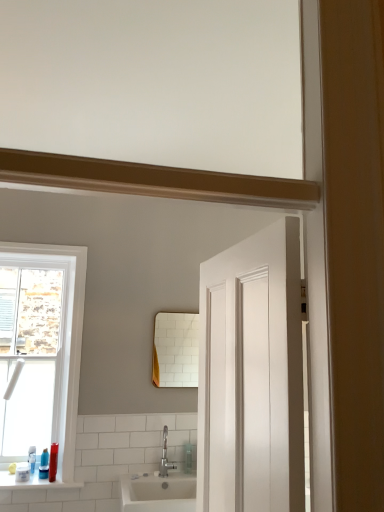
Question: Would you say translucent plastic bottle at lower left, the 2th toiletry positioned from the left, is to the left or to the right of white glossy window at left in the picture?

Choices:
 (A) right
 (B) left

Answer: (A)

Question: In terms of width, does translucent plastic bottle at lower left, which ranks as the first toiletry in right-to-left order, look wider or thinner when compared to white glossy window at left?

Choices:
 (A) thin
 (B) wide

Answer: (B)

Question: Estimate the real-world distances between objects in this image. Which object is closer to the translucent plastic soap at lower left, which ranks as the second toiletry in right-to-left order?

Choices:
 (A) translucent plastic bottle at lower left, the 2th toiletry positioned from the left
 (B) white glossy window at left
 (C) clear plastic soap dispenser at center
 (D) white glossy window sill at lower left
 (E) silver metallic faucet at lower center

Answer: (D)

Question: Based on their relative distances, which object is farther from the clear plastic soap dispenser at center?

Choices:
 (A) translucent plastic soap at lower left, which appears as the first toiletry when viewed from the left
 (B) silver metallic faucet at lower center
 (C) white glossy window at left
 (D) white glossy window sill at lower left
 (E) translucent plastic bottle at lower left, which ranks as the first toiletry in right-to-left order

Answer: (C)